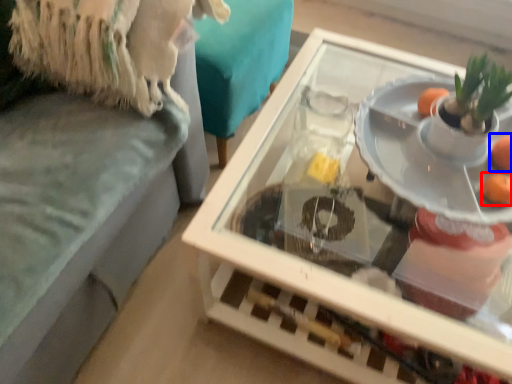
Question: Which object appears closest to the camera in this image, orange (highlighted by a red box) or orange (highlighted by a blue box)?

Choices:
 (A) orange
 (B) orange

Answer: (A)